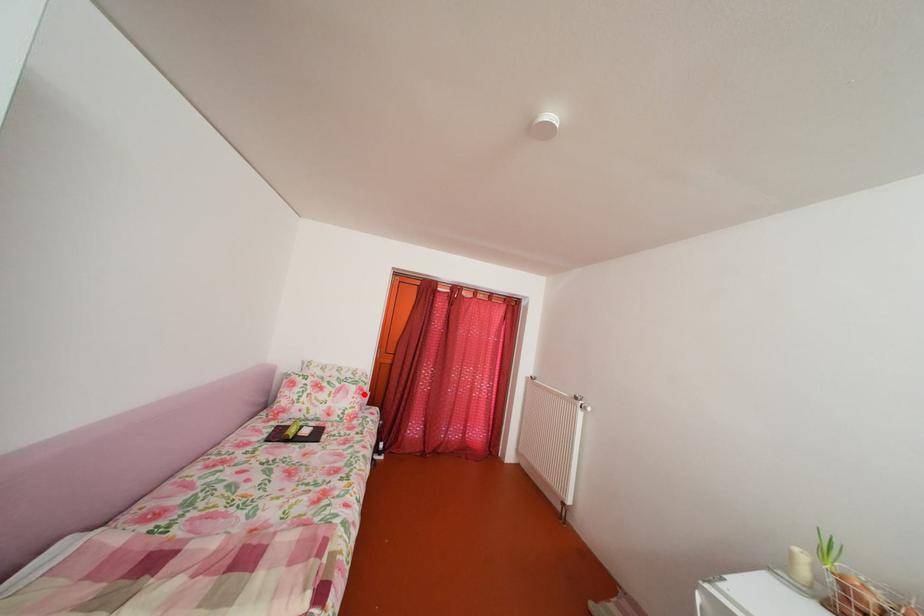
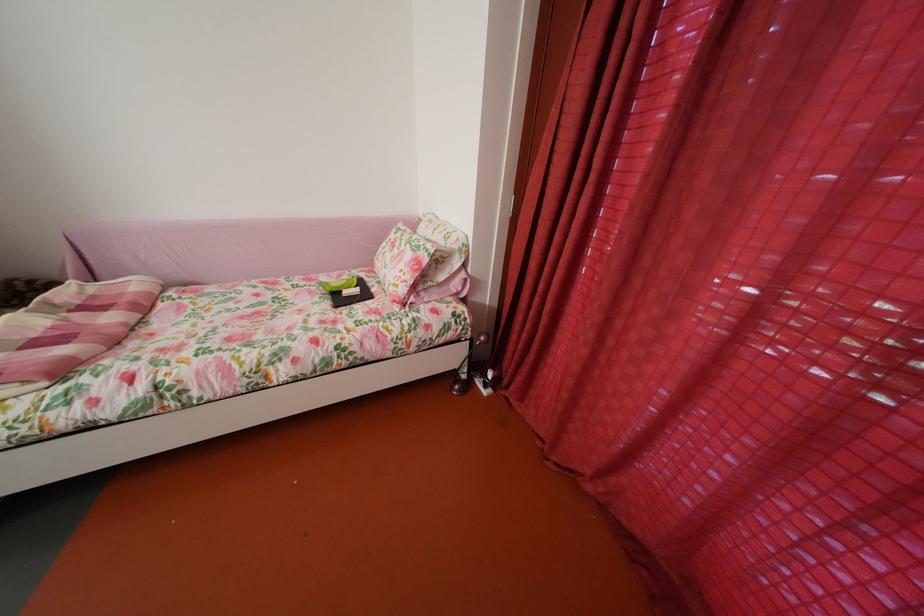
Question: A red point is marked in image1. In image2, is the corresponding 3D point closer to the camera or farther? Reply with the corresponding letter.

Choices:
 (A) The corresponding 3D point is closer.
 (B) The corresponding 3D point is farther.

Answer: (A)